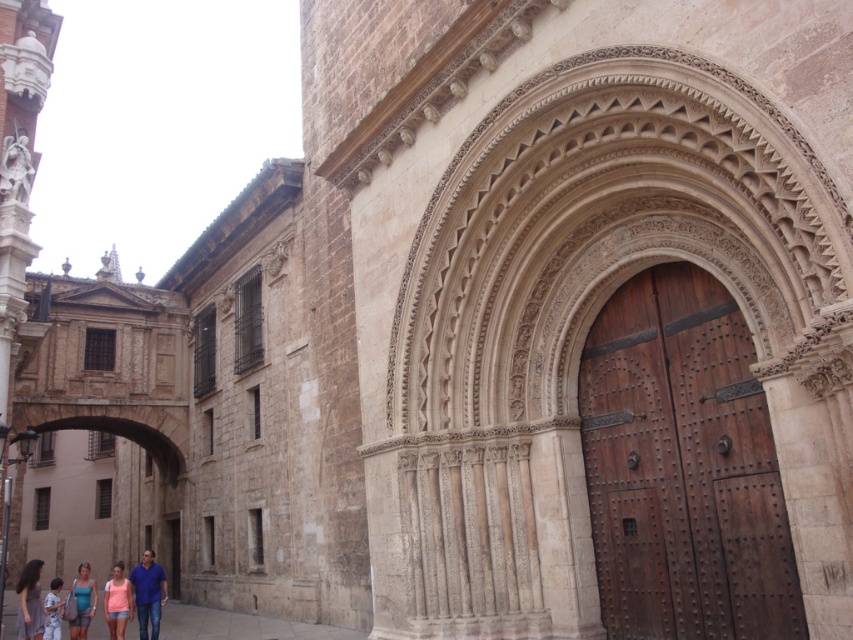
Which of these two, pink fabric shorts at lower left or matte blue tank top at lower left, stands shorter?

pink fabric shorts at lower left

Does pink fabric shorts at lower left have a lesser height compared to matte blue tank top at lower left?

Indeed, pink fabric shorts at lower left has a lesser height compared to matte blue tank top at lower left.

Who is more forward, (114, 563) or (77, 602)?

Point (77, 602) is more forward.

Locate an element on the screen. pink fabric shorts at lower left is located at coordinates (117, 602).

Is brown wooden door at center closer to the viewer compared to pink fabric shorts at lower left?

Yes.

Can you confirm if brown wooden door at center is positioned to the left of pink fabric shorts at lower left?

In fact, brown wooden door at center is to the right of pink fabric shorts at lower left.

Image resolution: width=853 pixels, height=640 pixels. What do you see at coordinates (683, 467) in the screenshot? I see `brown wooden door at center` at bounding box center [683, 467].

You are a GUI agent. You are given a task and a screenshot of the screen. Output one action in this format:
    pyautogui.click(x=<x>, y=<y>)
    Task: Click on the brown wooden door at center
    The width and height of the screenshot is (853, 640).
    Given the screenshot: What is the action you would take?
    pos(683,467)

Who is more forward, (39, 588) or (119, 614)?

Point (119, 614)

Is point (22, 577) farther from viewer compared to point (109, 637)?

No, (22, 577) is closer to viewer.

This screenshot has height=640, width=853. Identify the location of light pink fabric at lower left. (30, 602).

The height and width of the screenshot is (640, 853). Identify the location of light pink fabric at lower left. (30, 602).